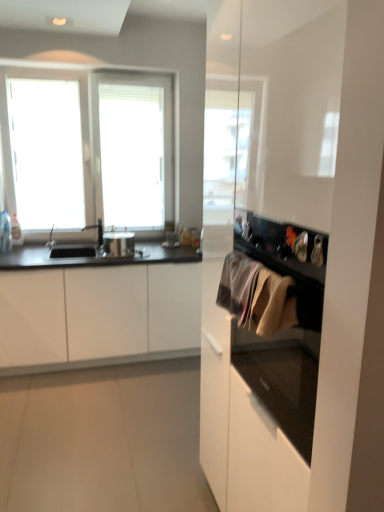
Where is `shiny metallic pot at center`? This screenshot has height=512, width=384. shiny metallic pot at center is located at coordinates (119, 244).

Describe the element at coordinates (98, 230) in the screenshot. I see `silver metallic faucet at left` at that location.

Where is `white matte cabinet at left`? This screenshot has width=384, height=512. white matte cabinet at left is located at coordinates (97, 316).

I want to click on textured beige towel at center right, so click(256, 295).

Find the location of a particular element. Image resolution: width=384 pixels, height=512 pixels. shiny metallic pot at center is located at coordinates (119, 244).

Identify the location of dresser on the right of white matte cabinet at left. (298, 258).

Is white glossy cabinet at right completely or partially inside white matte cabinet at left?

That's incorrect, white glossy cabinet at right is not inside white matte cabinet at left.

Which object is positioned more to the right, white matte cabinet at left or white glossy cabinet at right?

Positioned to the right is white glossy cabinet at right.

Can you confirm if textured beige towel at center right is wider than silver metallic faucet at left?

No, textured beige towel at center right is not wider than silver metallic faucet at left.

From the image's perspective, between textured beige towel at center right and silver metallic faucet at left, who is located below?

From the image's view, textured beige towel at center right is below.

Does white glossy cabinet at right turn towards silver metallic faucet at left?

No, white glossy cabinet at right is not facing towards silver metallic faucet at left.

Is point (217, 25) positioned in front of point (98, 231)?

Yes, it is.

Is white glossy cabinet at right at the left side of silver metallic faucet at left?

No.

Between white glossy cabinet at right and white matte cabinet at left, which one has smaller width?

white glossy cabinet at right is thinner.

Is point (300, 335) behind point (33, 286)?

No, (300, 335) is closer to viewer.

Can you confirm if white glossy cabinet at right is positioned to the right of white matte cabinet at left?

Yes, white glossy cabinet at right is to the right of white matte cabinet at left.

Is silver metallic faucet at left not within shiny metallic pot at center?

Yes, silver metallic faucet at left is located beyond the bounds of shiny metallic pot at center.

Can you confirm if silver metallic faucet at left is taller than shiny metallic pot at center?

Indeed, silver metallic faucet at left has a greater height compared to shiny metallic pot at center.

Consider the image. How far apart are silver metallic faucet at left and shiny metallic pot at center?

The distance of silver metallic faucet at left from shiny metallic pot at center is 16.27 centimeters.

Can you confirm if silver metallic faucet at left is thinner than shiny metallic pot at center?

Yes, silver metallic faucet at left is thinner than shiny metallic pot at center.

Where is `appliance lying above the textured beige towel at center right (from the image's perspective)`? The height and width of the screenshot is (512, 384). appliance lying above the textured beige towel at center right (from the image's perspective) is located at coordinates (119, 244).

Is shiny metallic pot at center wider or thinner than textured beige towel at center right?

Considering their sizes, shiny metallic pot at center looks broader than textured beige towel at center right.

From a real-world perspective, relative to textured beige towel at center right, is shiny metallic pot at center vertically above or below?

shiny metallic pot at center is situated lower than textured beige towel at center right in the real world.

Does shiny metallic pot at center have a smaller size compared to textured beige towel at center right?

No.

Between shiny metallic pot at center and white matte cabinet at left, which one appears on the right side from the viewer's perspective?

From the viewer's perspective, shiny metallic pot at center appears more on the right side.

Considering the relative sizes of shiny metallic pot at center and white matte cabinet at left in the image provided, is shiny metallic pot at center smaller than white matte cabinet at left?

Yes.

Does shiny metallic pot at center have a lesser width compared to white matte cabinet at left?

Indeed, shiny metallic pot at center has a lesser width compared to white matte cabinet at left.

Between shiny metallic pot at center and white matte cabinet at left, which one is positioned in front?

white matte cabinet at left is in front.

This screenshot has width=384, height=512. In the image, there is a white glossy cabinet at right. Find the location of `cabinetry below it (from the image's perspective)`. cabinetry below it (from the image's perspective) is located at coordinates (97, 316).

Identify the location of faucet below the textured beige towel at center right (from a real-world perspective). The image size is (384, 512). coord(98,230).

When comparing their distances from shiny metallic pot at center, does textured beige towel at center right or white glossy cabinet at right seem further?

textured beige towel at center right is further to shiny metallic pot at center.

When comparing their distances from textured beige towel at center right, does shiny metallic pot at center or silver metallic faucet at left seem further?

silver metallic faucet at left is further to textured beige towel at center right.

From the picture: Estimate the real-world distances between objects in this image. Which object is further from textured beige towel at center right, silver metallic faucet at left or shiny metallic pot at center?

Based on the image, silver metallic faucet at left appears to be further to textured beige towel at center right.

Which object lies further to the anchor point textured beige towel at center right, white glossy cabinet at right or shiny metallic pot at center?

The object further to textured beige towel at center right is shiny metallic pot at center.

When comparing their distances from white matte cabinet at left, does shiny metallic pot at center or silver metallic faucet at left seem closer?

The object closer to white matte cabinet at left is shiny metallic pot at center.

When comparing their distances from white glossy cabinet at right, does textured beige towel at center right or shiny metallic pot at center seem further?

shiny metallic pot at center.

When comparing their distances from white matte cabinet at left, does shiny metallic pot at center or textured beige towel at center right seem closer?

Based on the image, shiny metallic pot at center appears to be nearer to white matte cabinet at left.

When comparing their distances from textured beige towel at center right, does white matte cabinet at left or silver metallic faucet at left seem further?

The object further to textured beige towel at center right is silver metallic faucet at left.

I want to click on laundry between white glossy cabinet at right and white matte cabinet at left from front to back, so click(256, 295).

In order to click on appliance between white glossy cabinet at right and silver metallic faucet at left from front to back in this screenshot , I will do `click(119, 244)`.

Where is `appliance between silver metallic faucet at left and white matte cabinet at left from top to bottom`? appliance between silver metallic faucet at left and white matte cabinet at left from top to bottom is located at coordinates (119, 244).

Identify the location of cabinetry between white glossy cabinet at right and silver metallic faucet at left in the front-back direction. (97, 316).